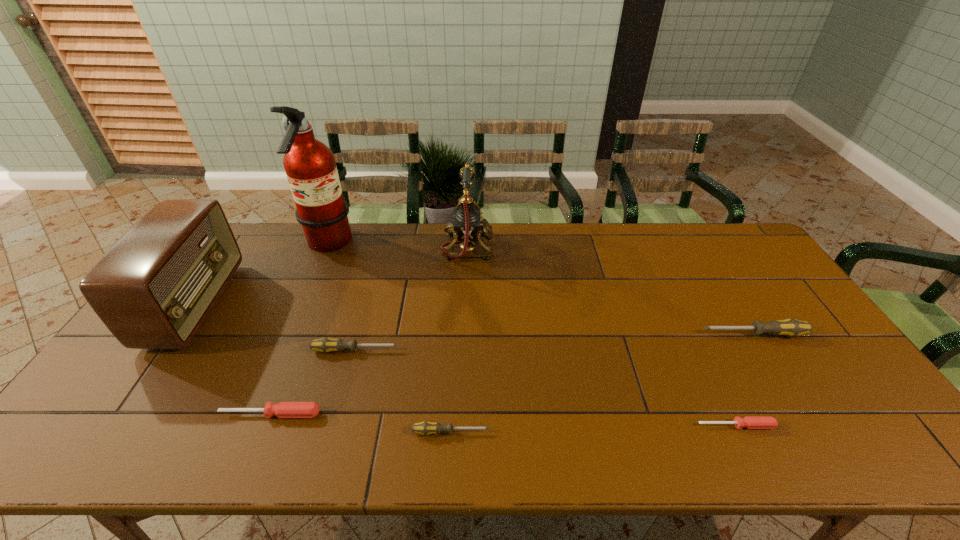
The height and width of the screenshot is (540, 960). I want to click on the tallest object, so click(x=310, y=166).

Find the location of `black telephone`. black telephone is located at coordinates (467, 224).

Image resolution: width=960 pixels, height=540 pixels. I want to click on radio receiver, so click(x=153, y=289).

I want to click on the rightmost gray screwdriver, so click(790, 327).

Find the location of a particular element. the fifth shortest object is located at coordinates (790, 327).

Find the location of a particular element. the second farthest gray screwdriver is located at coordinates (325, 345).

The image size is (960, 540). In order to click on the second farthest screwdriver in this screenshot , I will do `click(325, 345)`.

Find the location of a particular element. the bigger red screwdriver is located at coordinates (284, 409).

Where is `the left red screwdriver`? This screenshot has height=540, width=960. the left red screwdriver is located at coordinates (284, 409).

Find the location of a particular element. The height and width of the screenshot is (540, 960). the third screwdriver from right to left is located at coordinates (425, 428).